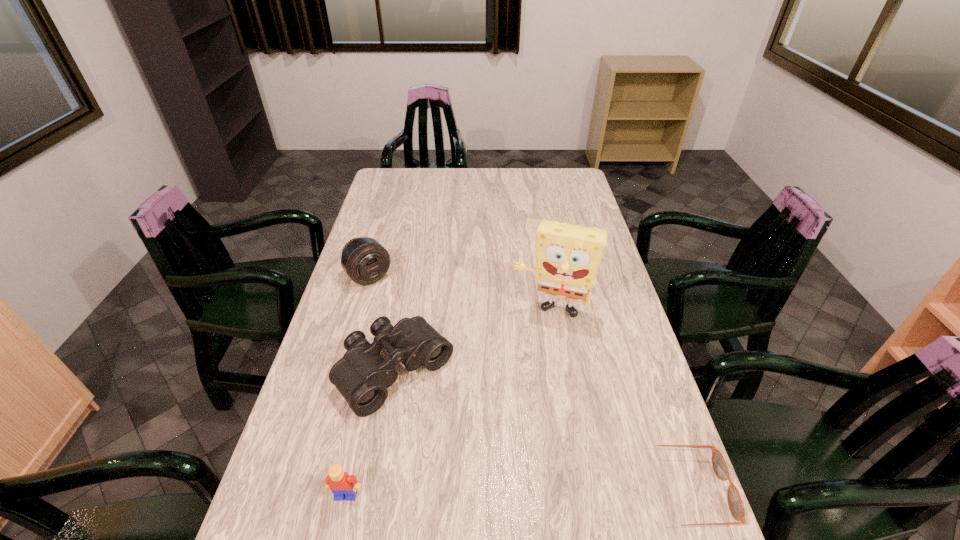
The image size is (960, 540). I want to click on free space between the sunglasses and the farthest object, so click(526, 383).

This screenshot has width=960, height=540. I want to click on vacant area that lies between the Lego and the tallest object, so point(448,403).

This screenshot has height=540, width=960. Find the location of `vacant area that lies between the rightmost object and the tallest object`. vacant area that lies between the rightmost object and the tallest object is located at coordinates (617, 401).

Locate an element on the screen. This screenshot has width=960, height=540. free area in between the farthest object and the fourth object from left to right is located at coordinates (460, 293).

The width and height of the screenshot is (960, 540). Identify the location of vacant space in between the Lego and the fourth nearest object. (448, 403).

Locate which object is the third closest to the binoculars. Please provide its 2D coordinates. Your answer should be formatted as a tuple, i.e. [(x, y)], where the tuple contains the x and y coordinates of a point satisfying the conditions above.

[(365, 260)]

This screenshot has width=960, height=540. In order to click on object that can be found as the second closest to the sponge in this screenshot , I will do `click(365, 260)`.

The image size is (960, 540). I want to click on free point that satisfies the following two spatial constraints: 1. on the front side of the binoculars; 2. on the front-facing side of the rightmost object, so click(375, 491).